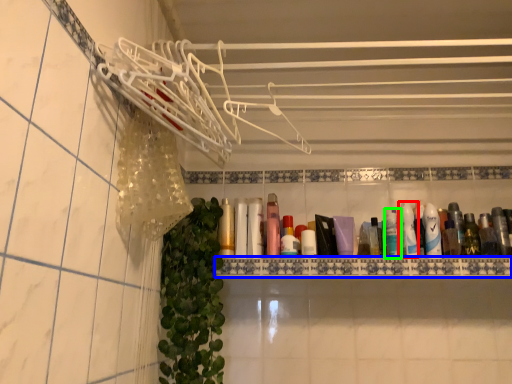
Question: Based on their relative distances, which object is farther from toiletry (highlighted by a red box)? Choose from ledge (highlighted by a blue box) and mouthwash (highlighted by a green box).

Choices:
 (A) ledge
 (B) mouthwash

Answer: (A)